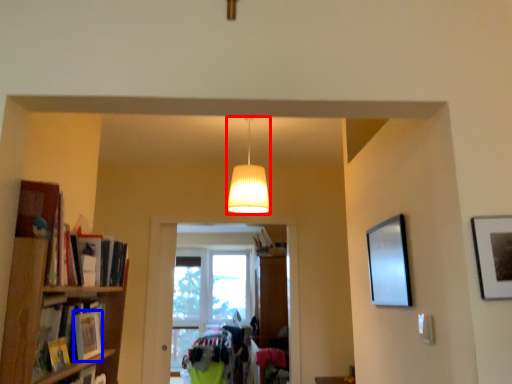
Question: Which object is further to the camera taking this photo, lamp (highlighted by a red box) or book (highlighted by a blue box)?

Choices:
 (A) lamp
 (B) book

Answer: (A)